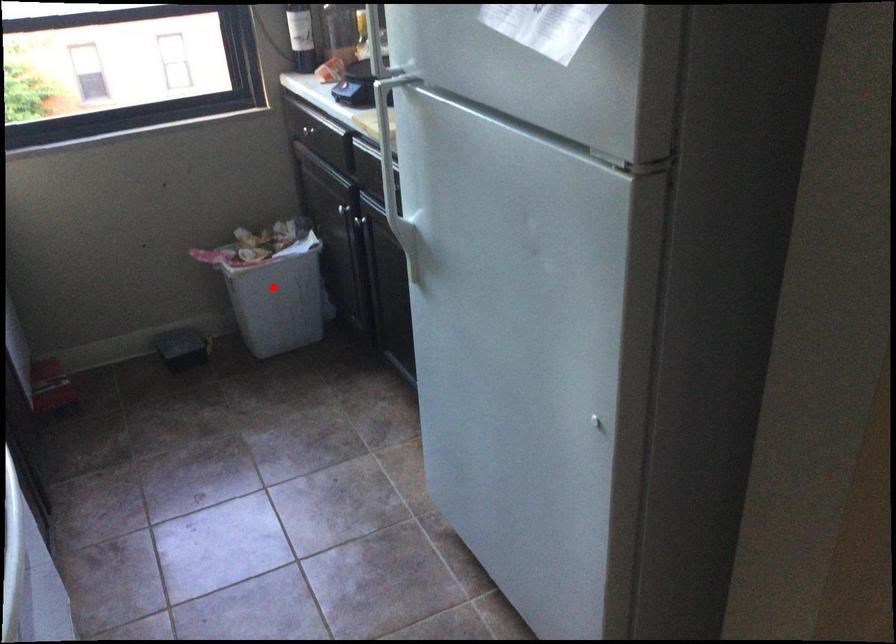
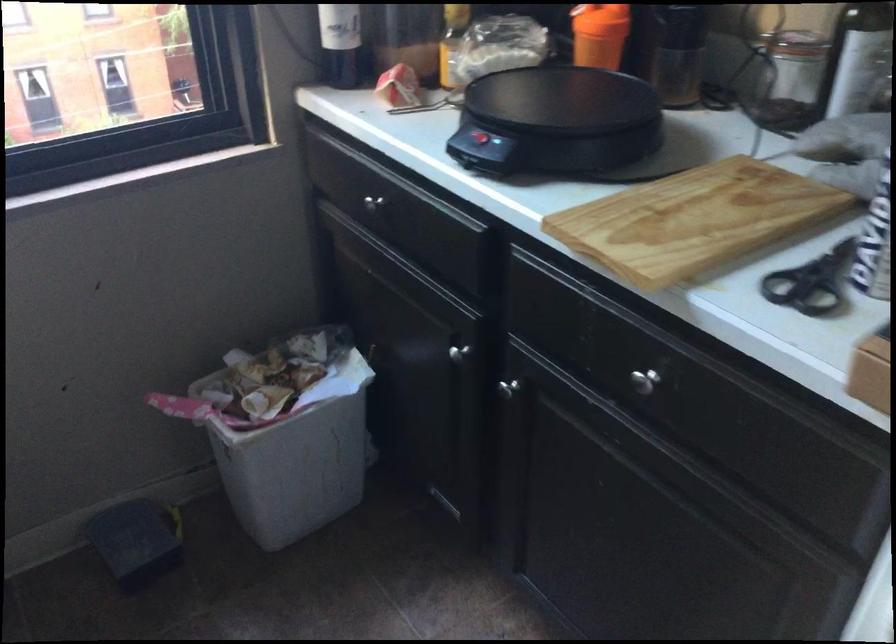
Where in the second image is the point corresponding to the highlighted location from the first image?

(296, 456)